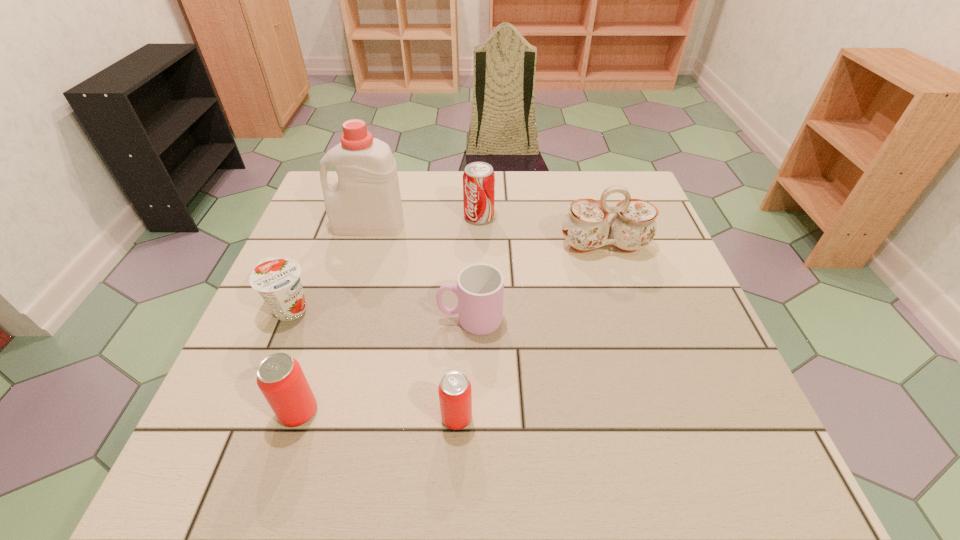
I want to click on unoccupied position between the cup and the chinaware, so pos(538,282).

You are a GUI agent. You are given a task and a screenshot of the screen. Output one action in this format:
    pyautogui.click(x=<x>, y=<y>)
    Task: Click on the vacant region between the cup and the rightmost object
    
    Given the screenshot: What is the action you would take?
    pyautogui.click(x=538, y=282)

The height and width of the screenshot is (540, 960). Identify the location of free spot between the chinaware and the taller beer can. (451, 329).

The width and height of the screenshot is (960, 540). Find the location of `blank region between the tallest object and the rightmost object`. blank region between the tallest object and the rightmost object is located at coordinates pos(487,235).

I want to click on vacant space that is in between the detergent and the right beer can, so click(x=413, y=322).

Identify the location of vacant space that's between the cup and the detergent. (420, 272).

The height and width of the screenshot is (540, 960). In order to click on free space that is in between the taller beer can and the rightmost object in this screenshot , I will do `click(451, 329)`.

The image size is (960, 540). Identify the location of free spot between the chinaware and the yogurt. (447, 278).

Select which object is the sixth closest to the detergent. Please provide its 2D coordinates. Your answer should be formatted as a tuple, i.e. [(x, y)], where the tuple contains the x and y coordinates of a point satisfying the conditions above.

[(455, 396)]

Locate an element on the screen. object that is the closest to the soda can is located at coordinates (366, 201).